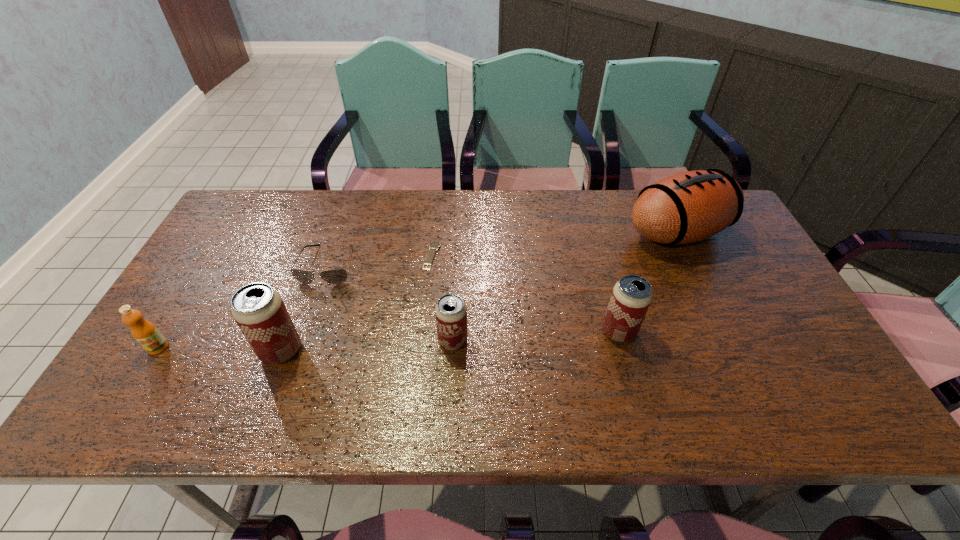
Please point a spot on the right to add another beer can. Please provide its 2D coordinates. Your answer should be formatted as a tuple, i.e. [(x, y)], where the tuple contains the x and y coordinates of a point satisfying the conditions above.

[(779, 322)]